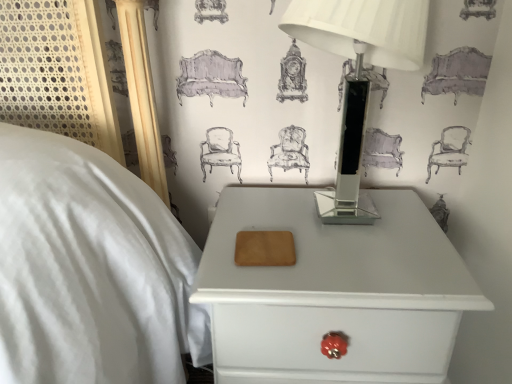
Question: Considering the relative positions of white glossy nightstand at lower right and clear glass table lamp at upper right in the image provided, is white glossy nightstand at lower right to the left of clear glass table lamp at upper right from the viewer's perspective?

Choices:
 (A) yes
 (B) no

Answer: (A)

Question: Considering the relative sizes of white glossy nightstand at lower right and clear glass table lamp at upper right in the image provided, is white glossy nightstand at lower right taller than clear glass table lamp at upper right?

Choices:
 (A) no
 (B) yes

Answer: (B)

Question: Is clear glass table lamp at upper right located within white glossy nightstand at lower right?

Choices:
 (A) yes
 (B) no

Answer: (B)

Question: Considering the relative positions of white glossy nightstand at lower right and clear glass table lamp at upper right in the image provided, is white glossy nightstand at lower right to the right of clear glass table lamp at upper right from the viewer's perspective?

Choices:
 (A) yes
 (B) no

Answer: (B)

Question: Are white glossy nightstand at lower right and clear glass table lamp at upper right beside each other?

Choices:
 (A) no
 (B) yes

Answer: (A)

Question: Could you tell me if white glossy nightstand at lower right is turned towards clear glass table lamp at upper right?

Choices:
 (A) no
 (B) yes

Answer: (A)

Question: From a real-world perspective, is clear glass table lamp at upper right located higher than white glossy nightstand at lower right?

Choices:
 (A) yes
 (B) no

Answer: (A)

Question: Can you confirm if clear glass table lamp at upper right is smaller than white glossy nightstand at lower right?

Choices:
 (A) yes
 (B) no

Answer: (A)

Question: Is the position of clear glass table lamp at upper right less distant than that of white glossy nightstand at lower right?

Choices:
 (A) yes
 (B) no

Answer: (A)

Question: Is clear glass table lamp at upper right bigger than white glossy nightstand at lower right?

Choices:
 (A) no
 (B) yes

Answer: (A)

Question: Is clear glass table lamp at upper right aimed at white glossy nightstand at lower right?

Choices:
 (A) yes
 (B) no

Answer: (B)

Question: From the image's perspective, is clear glass table lamp at upper right over white glossy nightstand at lower right?

Choices:
 (A) no
 (B) yes

Answer: (B)

Question: From a real-world perspective, is white glossy nightstand at lower right physically located above or below clear glass table lamp at upper right?

Choices:
 (A) below
 (B) above

Answer: (A)